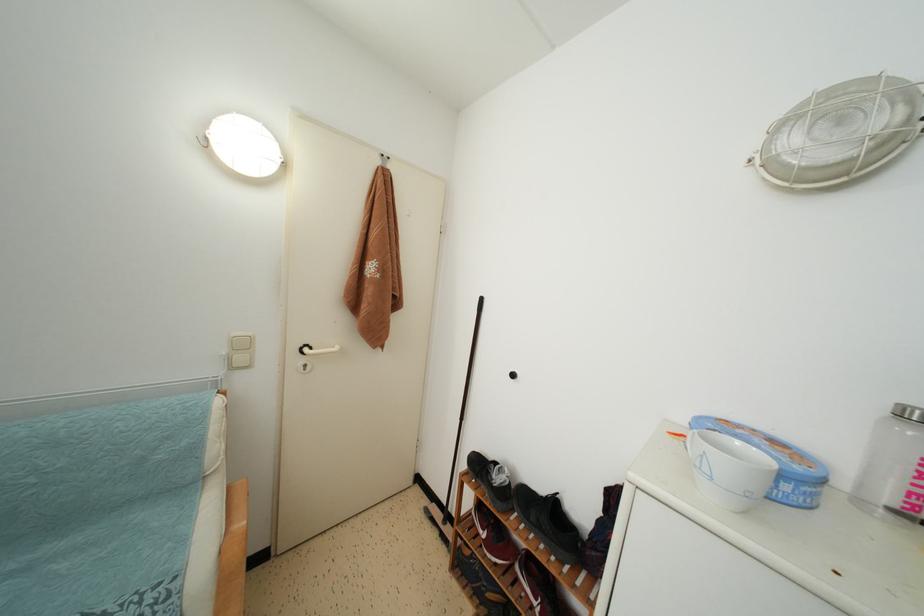
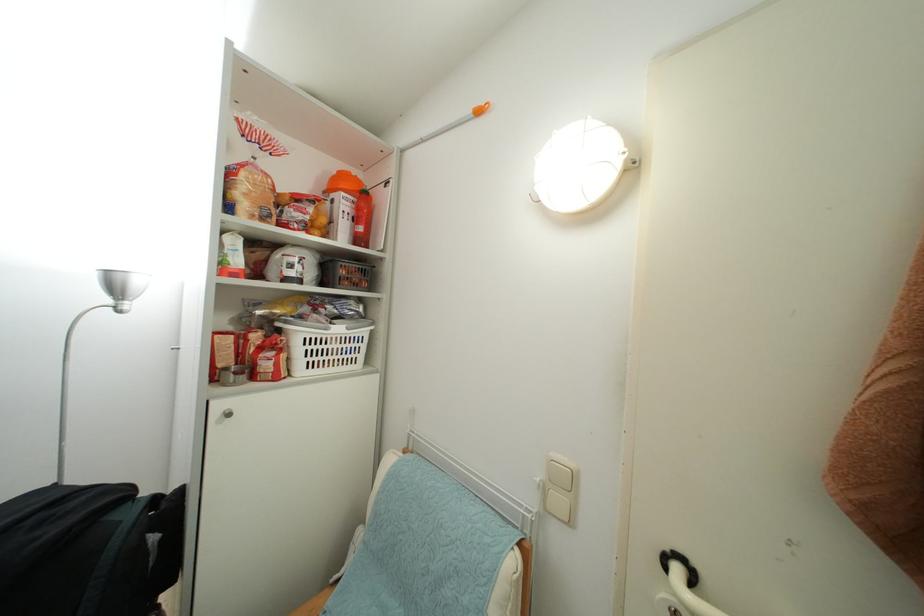
Question: The images are taken continuously from a first-person perspective. In which direction is your viewpoint rotating?

Choices:
 (A) Left
 (B) Right
 (C) Up
 (D) Down

Answer: (A)